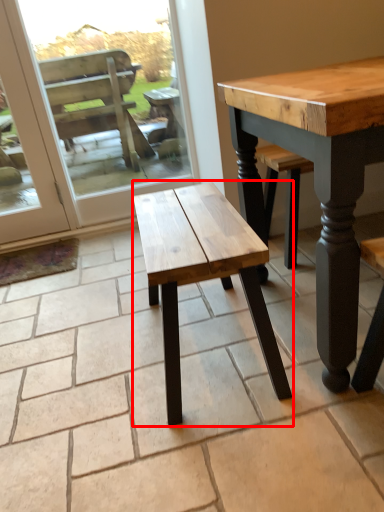
Question: From the image's perspective, where is stool (annotated by the red box) located relative to screen door?

Choices:
 (A) below
 (B) above

Answer: (A)